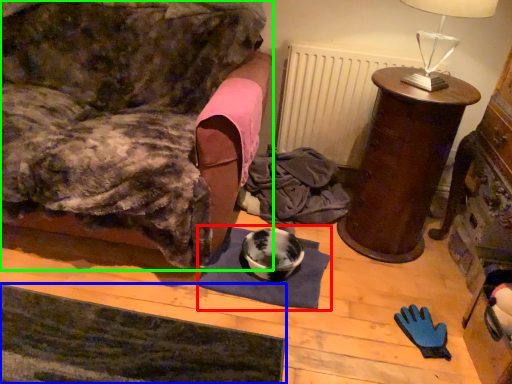
Question: Considering the real-world distances, which object is farthest from mat (highlighted by a red box)? yoga mat (highlighted by a blue box) or furniture (highlighted by a green box)?

Choices:
 (A) yoga mat
 (B) furniture

Answer: (B)